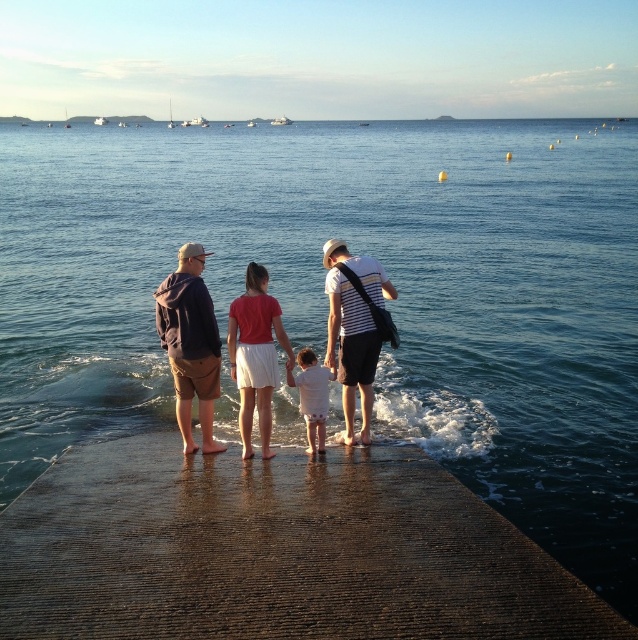
Based on the scene description, where is the dark concrete dock at center located in the image?

The dark concrete dock at center is located at point (274, 550).

You are a photographer trying to capture a photo of the dark concrete dock at center and the matte black clothing at center. Based on their positions, which one will appear closer to the camera in the photo?

The dark concrete dock at center is in front of matte black clothing at center, so it will appear closer to the camera in the photo.